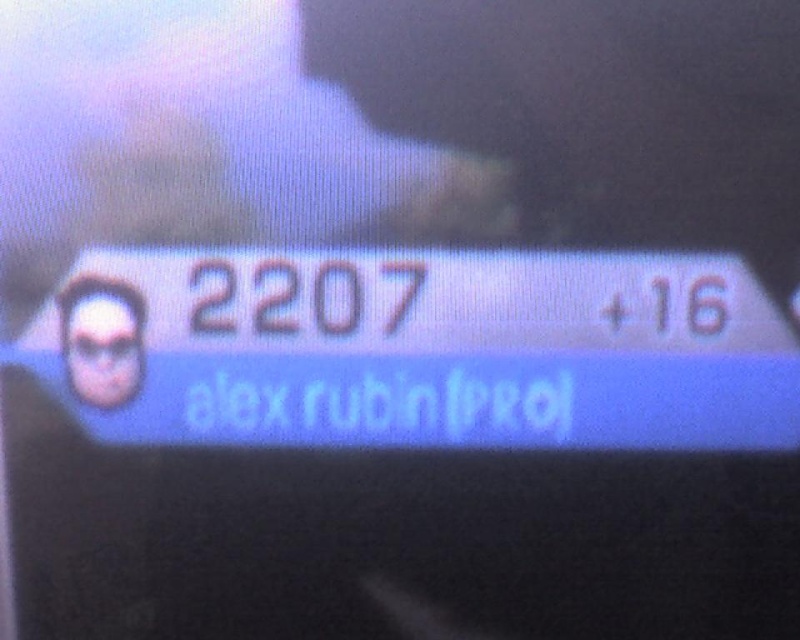
Between blue glossy text at center and matte black sunglasses at left, which one appears on the right side from the viewer's perspective?

blue glossy text at center

Looking at this image, can you confirm if blue glossy text at center is positioned above matte black sunglasses at left?

Actually, blue glossy text at center is below matte black sunglasses at left.

Find the location of `blue glossy text at center`. blue glossy text at center is located at coordinates (417, 349).